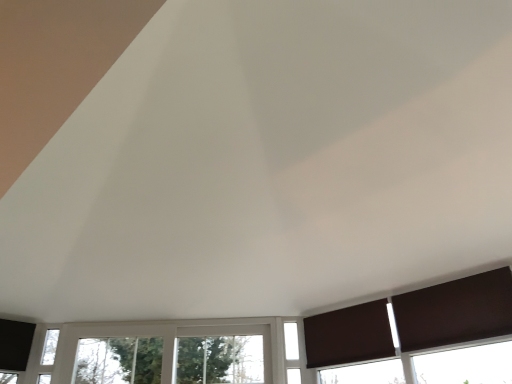
Question: Based on their sizes in the image, would you say white plastic window at center, marked as the second window in a right-to-left arrangement, is bigger or smaller than brown matte curtain at lower right, the 2th curtain from the right?

Choices:
 (A) big
 (B) small

Answer: (A)

Question: Is white plastic window at center, placed as the first window when sorted from left to right, taller or shorter than brown matte curtain at lower right, arranged as the first curtain when viewed from the left?

Choices:
 (A) tall
 (B) short

Answer: (A)

Question: Which object is the farthest from the white plastic window at center, marked as the second window in a right-to-left arrangement?

Choices:
 (A) white glass window at center, which appears as the first window when viewed from the right
 (B) brown matte curtain at lower right, the 2th curtain from the right
 (C) brown matte curtain at lower right, which ranks as the first curtain in right-to-left order

Answer: (C)

Question: Estimate the real-world distances between objects in this image. Which object is farther from the brown matte curtain at lower right, the 2th curtain from the right?

Choices:
 (A) white glass window at center, the 2th window from the left
 (B) brown matte curtain at lower right, the 1th curtain when ordered from front to back
 (C) white plastic window at center, placed as the first window when sorted from left to right

Answer: (C)